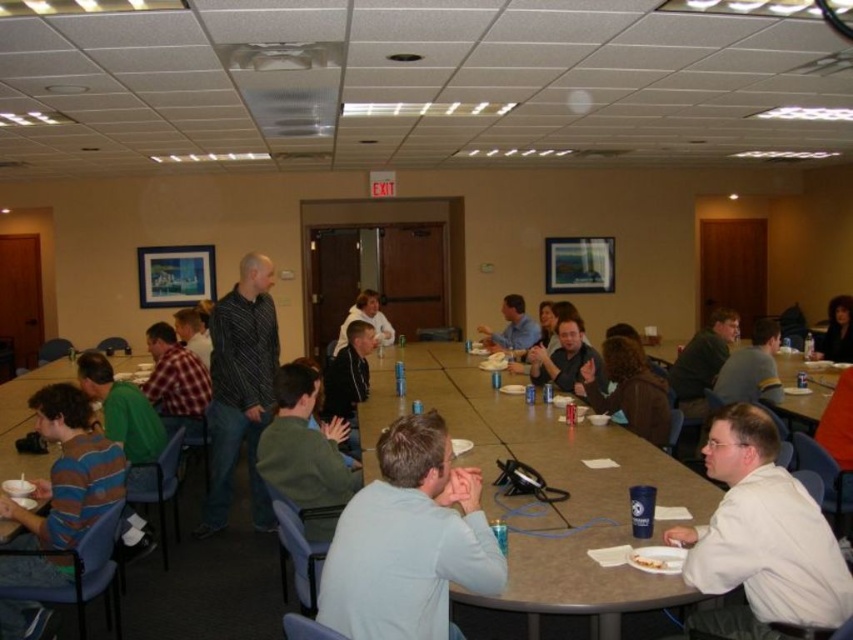
Does white matte shirt at lower right have a lesser height compared to green matte jacket at center?

Yes.

Who is more distant from viewer, (740, 500) or (310, 412)?

Point (310, 412)

Image resolution: width=853 pixels, height=640 pixels. Identify the location of white matte shirt at lower right. (761, 538).

Is point (209, 362) positioned behind point (641, 566)?

That is True.

Is point (195, 342) more distant than point (645, 561)?

That is True.

Locate an element on the screen. The height and width of the screenshot is (640, 853). plaid shirt at center is located at coordinates (193, 333).

Between white matte shirt at lower right and white paper plate at lower center, which one has more height?

With more height is white matte shirt at lower right.

Is white matte shirt at lower right closer to camera compared to white paper plate at lower center?

Yes, it is.

Who is more distant from viewer, (729,436) or (639,566)?

Point (729,436)

Image resolution: width=853 pixels, height=640 pixels. I want to click on white matte shirt at lower right, so click(761, 538).